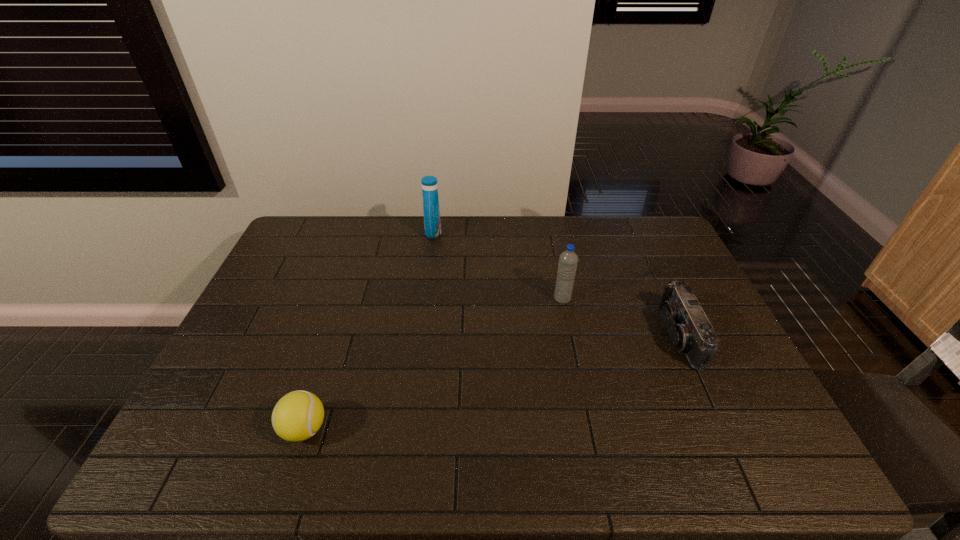
Find the location of a particular element. Image resolution: width=960 pixels, height=540 pixels. free space between the nearest object and the third object from left to right is located at coordinates (433, 364).

Image resolution: width=960 pixels, height=540 pixels. Find the location of `free area in between the water bottle and the rightmost object`. free area in between the water bottle and the rightmost object is located at coordinates (621, 317).

I want to click on vacant region between the third object from left to right and the detergent, so click(x=497, y=265).

Where is `free space between the farthest object and the third object from left to right`? free space between the farthest object and the third object from left to right is located at coordinates (497, 265).

You are a GUI agent. You are given a task and a screenshot of the screen. Output one action in this format:
    pyautogui.click(x=<x>, y=<y>)
    Task: Click on the free point between the farthest object and the water bottle
    The width and height of the screenshot is (960, 540).
    Given the screenshot: What is the action you would take?
    pyautogui.click(x=497, y=265)

Locate an element on the screen. The image size is (960, 540). empty space between the nearest object and the water bottle is located at coordinates (433, 364).

Locate an element on the screen. blank region between the farthest object and the water bottle is located at coordinates (497, 265).

Locate an element on the screen. This screenshot has width=960, height=540. blank region between the water bottle and the camcorder is located at coordinates (621, 317).

Where is `object that stands as the closest to the detergent`? The image size is (960, 540). object that stands as the closest to the detergent is located at coordinates (568, 260).

Choose which object is the nearest neighbor to the leftmost object. Please provide its 2D coordinates. Your answer should be formatted as a tuple, i.e. [(x, y)], where the tuple contains the x and y coordinates of a point satisfying the conditions above.

[(568, 260)]